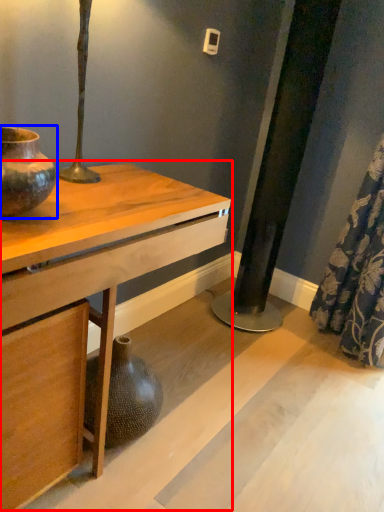
Question: Which object is closer to the camera taking this photo, table (highlighted by a red box) or vase (highlighted by a blue box)?

Choices:
 (A) table
 (B) vase

Answer: (A)